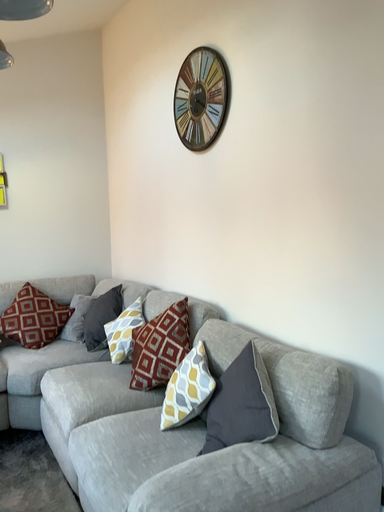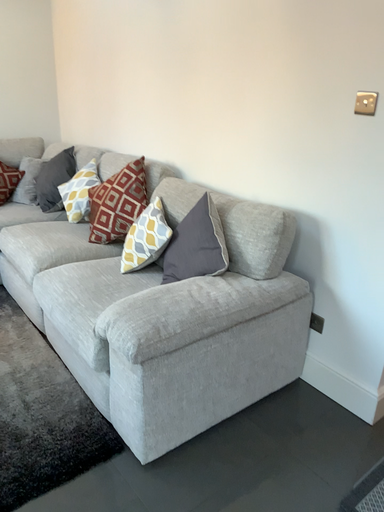
Question: Which way did the camera rotate in the video?

Choices:
 (A) rotated downward
 (B) rotated upward

Answer: (A)